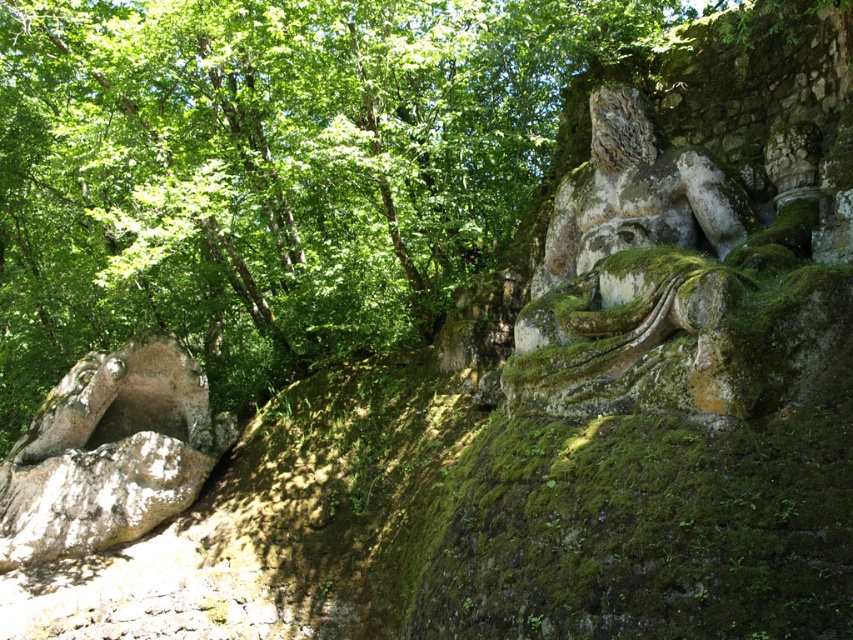
Does green mossy stone reclining figure at right appear on the left side of green mossy stone statue at upper right?

Incorrect, green mossy stone reclining figure at right is not on the left side of green mossy stone statue at upper right.

Between green mossy stone reclining figure at right and green mossy stone statue at upper right, which one is positioned higher?

green mossy stone statue at upper right is higher up.

Is point (573, 291) positioned before point (612, 164)?

Yes.

You are a GUI agent. You are given a task and a screenshot of the screen. Output one action in this format:
    pyautogui.click(x=<x>, y=<y>)
    Task: Click on the green mossy stone reclining figure at right
    This screenshot has width=853, height=640.
    Given the screenshot: What is the action you would take?
    pyautogui.click(x=666, y=285)

Between green mossy stone reclining figure at right and rough textured rock at left, which one is positioned lower?

rough textured rock at left is lower down.

Is green mossy stone reclining figure at right to the right of rough textured rock at left from the viewer's perspective?

Yes, green mossy stone reclining figure at right is to the right of rough textured rock at left.

I want to click on green mossy stone reclining figure at right, so click(x=666, y=285).

The height and width of the screenshot is (640, 853). What do you see at coordinates (109, 452) in the screenshot? I see `rough textured rock at left` at bounding box center [109, 452].

Does rough textured rock at left lie behind green mossy stone statue at upper right?

Yes, it is.

You are a GUI agent. You are given a task and a screenshot of the screen. Output one action in this format:
    pyautogui.click(x=<x>, y=<y>)
    Task: Click on the rough textured rock at left
    
    Given the screenshot: What is the action you would take?
    pyautogui.click(x=109, y=452)